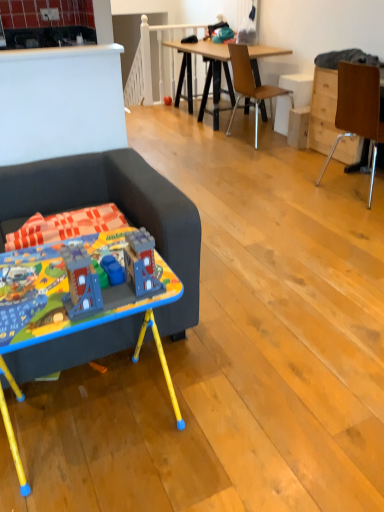
Find the location of `vacant space underneath plastic toy castle at left, which is the 2th toy in back-to-front order (from a real-world perspective)`. vacant space underneath plastic toy castle at left, which is the 2th toy in back-to-front order (from a real-world perspective) is located at coordinates (114, 296).